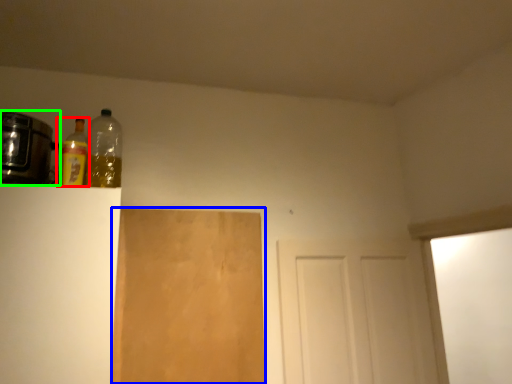
Question: Which object is the closest to the bottle (highlighted by a red box)? Choose among these: plywood (highlighted by a blue box) or appliance (highlighted by a green box).

Choices:
 (A) plywood
 (B) appliance

Answer: (B)